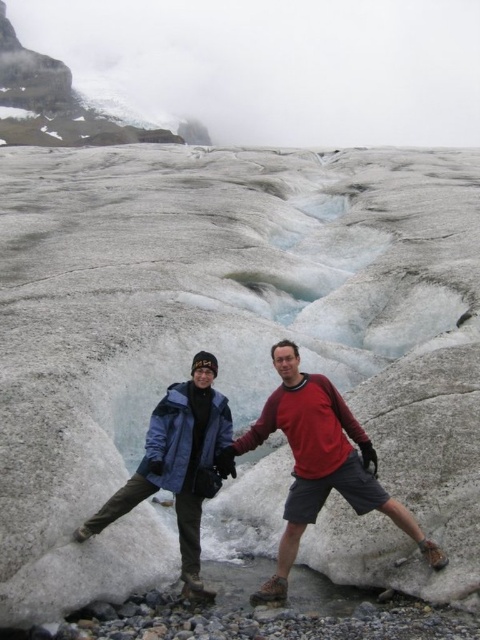
Does matte red shirt at center have a smaller size compared to blue jacket at center?

Actually, matte red shirt at center might be larger than blue jacket at center.

Who is lower down, matte red shirt at center or blue jacket at center?

blue jacket at center is below.

The width and height of the screenshot is (480, 640). Identify the location of matte red shirt at center. (317, 461).

Identify the location of matte red shirt at center. (317, 461).